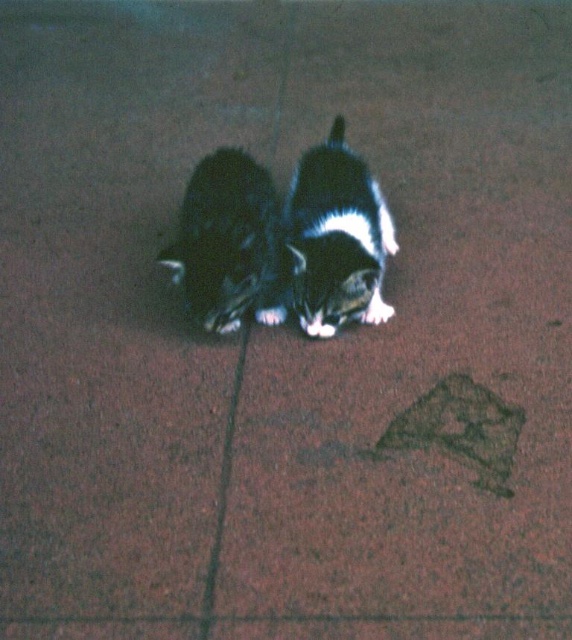
Does point (343, 228) lie behind point (241, 298)?

Yes, point (343, 228) is farther from viewer.

Does black and white fur cat at center appear under black fur cat at center?

Yes.

Between point (299, 305) and point (204, 316), which one is positioned behind?

The point (299, 305) is more distant.

What are the coordinates of `black and white fur cat at center` in the screenshot? It's located at (331, 243).